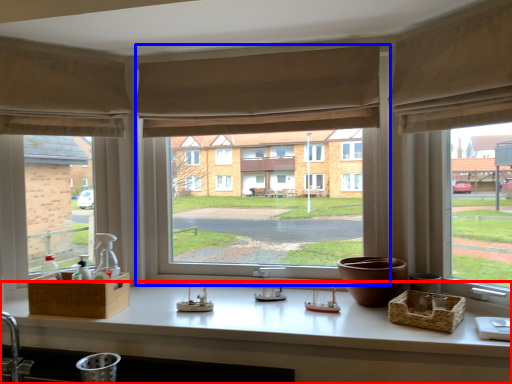
Question: Which point is closer to the camera, counter top (highlighted by a red box) or window (highlighted by a blue box)?

Choices:
 (A) counter top
 (B) window

Answer: (A)